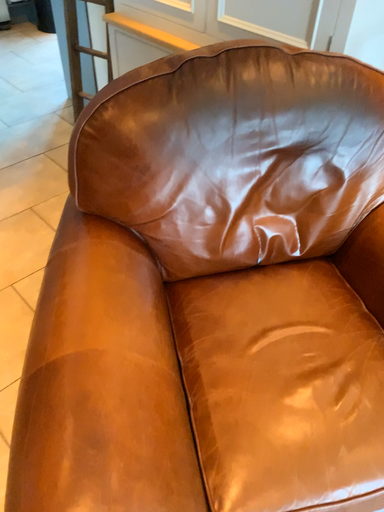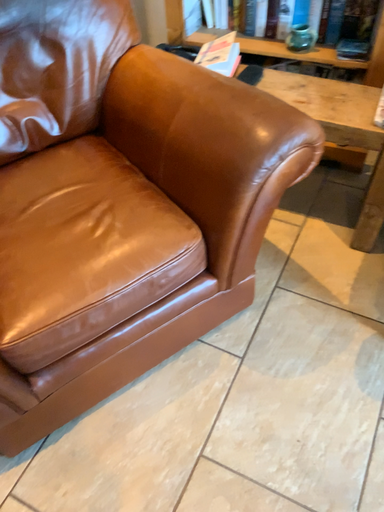
Question: Which way did the camera rotate in the video?

Choices:
 (A) rotated left
 (B) rotated right

Answer: (B)